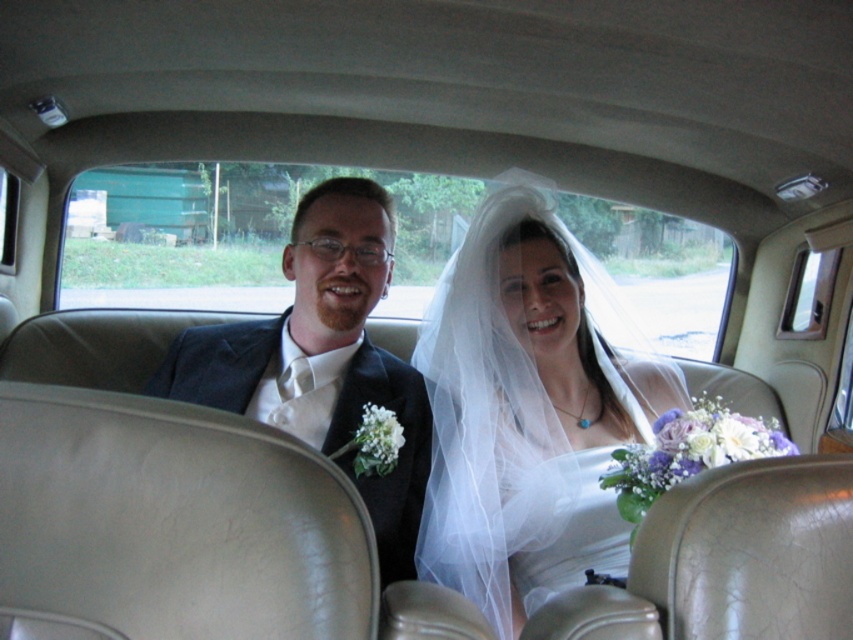
Question: Is white sheer veil at center further to camera compared to matte black suit at left?

Choices:
 (A) yes
 (B) no

Answer: (B)

Question: Which point is closer to the camera taking this photo?

Choices:
 (A) (347, 220)
 (B) (532, 420)

Answer: (A)

Question: Is white sheer veil at center bigger than matte black suit at left?

Choices:
 (A) no
 (B) yes

Answer: (B)

Question: Is white sheer veil at center bigger than matte black suit at left?

Choices:
 (A) yes
 (B) no

Answer: (A)

Question: Which point is farther to the camera?

Choices:
 (A) white sheer veil at center
 (B) matte black suit at left

Answer: (B)